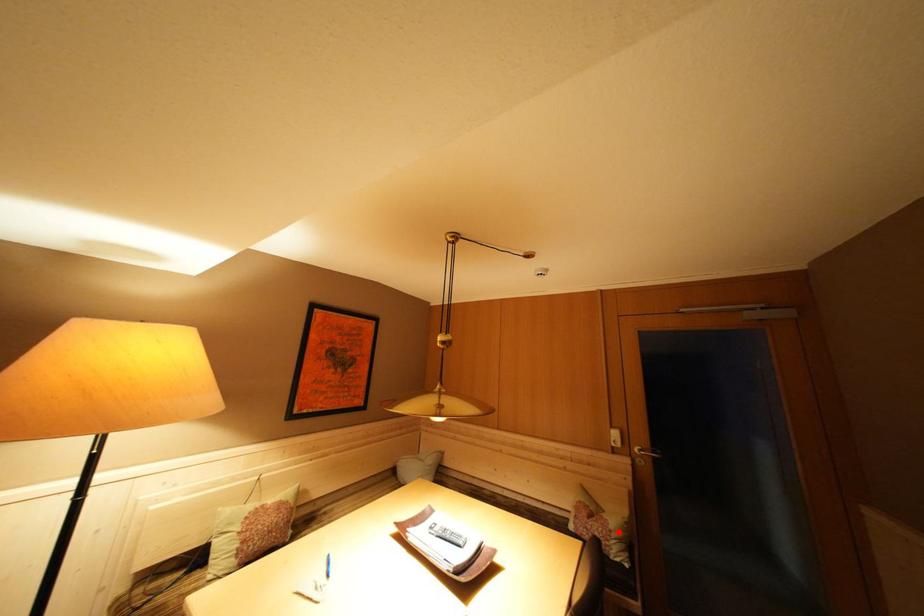
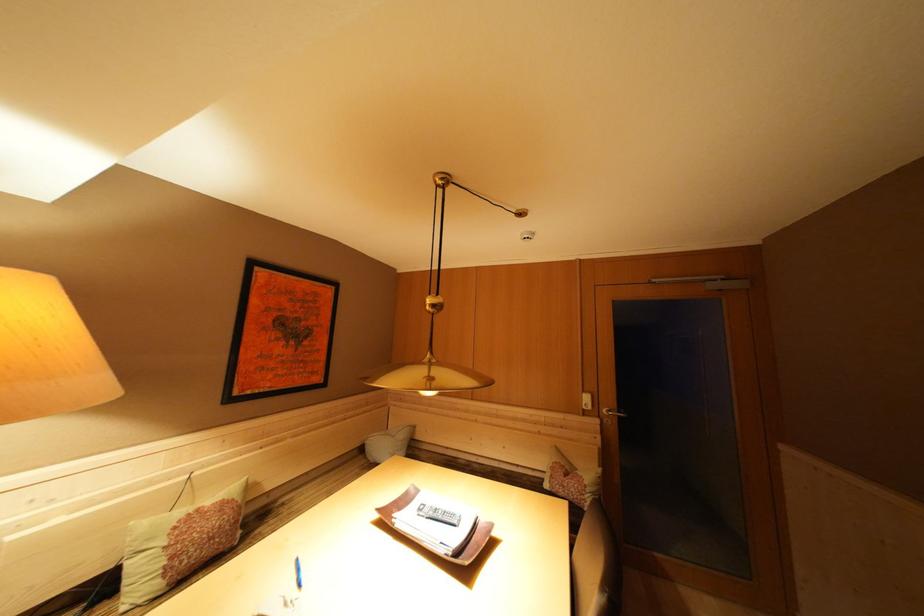
Question: I am providing you with two images of the same scene from different viewpoints. A red point is marked on the first image. At the location where the point appears in image 1, is it still visible in image 2?

Choices:
 (A) Yes
 (B) No

Answer: (A)